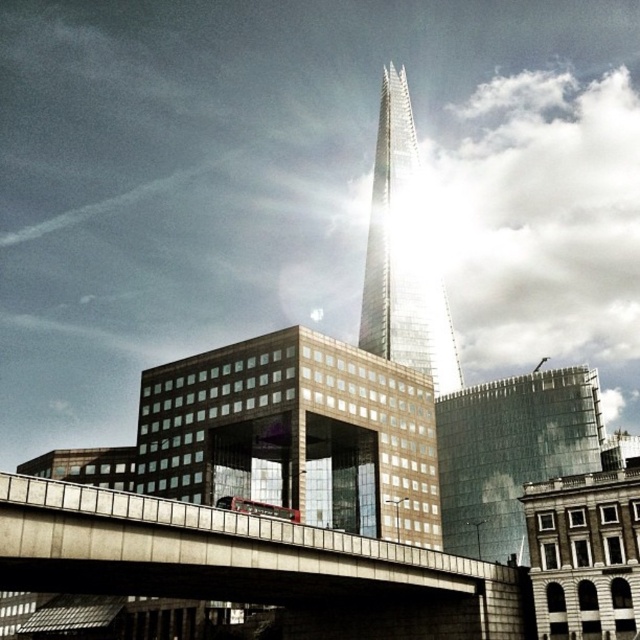
You are standing in the urban landscape and want to take a photo of both the concrete bridge at center and the shiny glass skyscraper at center. Which one should you focus on first to ensure both are in the frame?

You should focus on the shiny glass skyscraper at center first because the concrete bridge at center is closer to the viewer, so adjusting focus starting from the farther object allows both to be in the frame.

You are a city planner evaluating the urban layout. Given the scene, which of the two structures at the center, the concrete bridge at center or the shiny glass skyscraper at center, would you estimate to have a greater height?

The shiny glass skyscraper at center is taller than the concrete bridge at center, as it pierces through the clouds and has a reflective glass facade, indicating its significant height.

You are standing in the urban landscape and want to place a small flag at the point closer to you between the two points marked as point (372, 566) and point (394, 202). Which point should you choose?

You should choose point (372, 566) because it is closer to the viewer than point (394, 202).